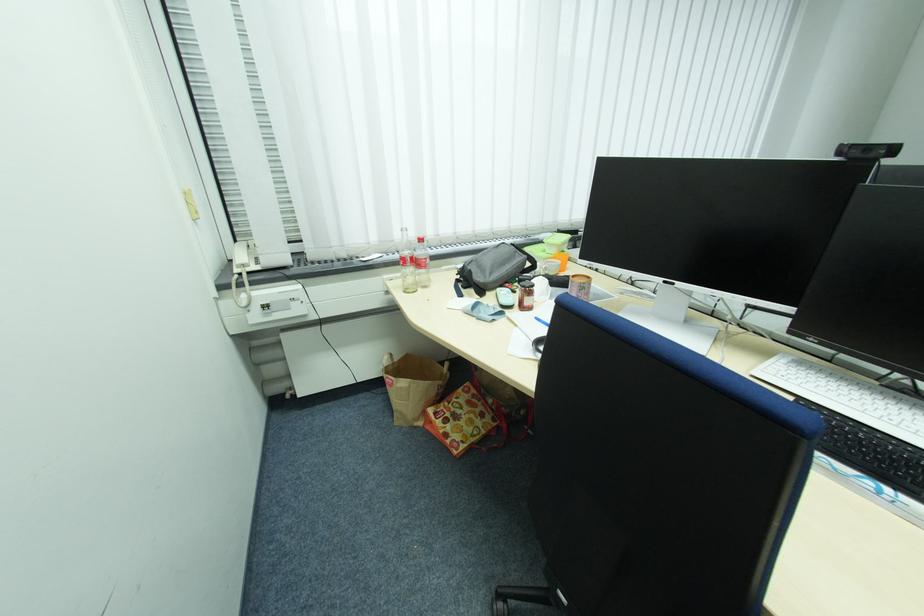
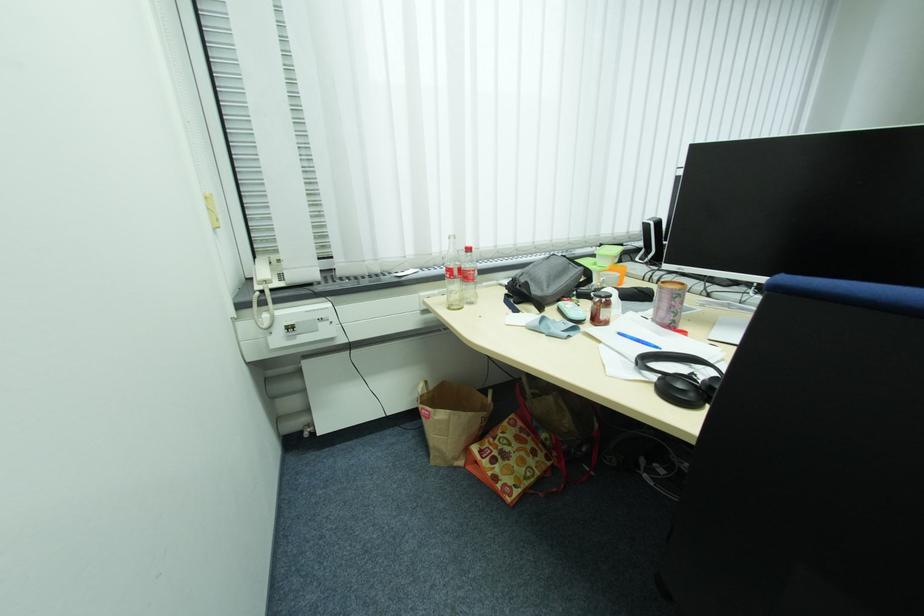
Where in the second image is the point corresponding to (x=423, y=419) from the first image?

(464, 460)